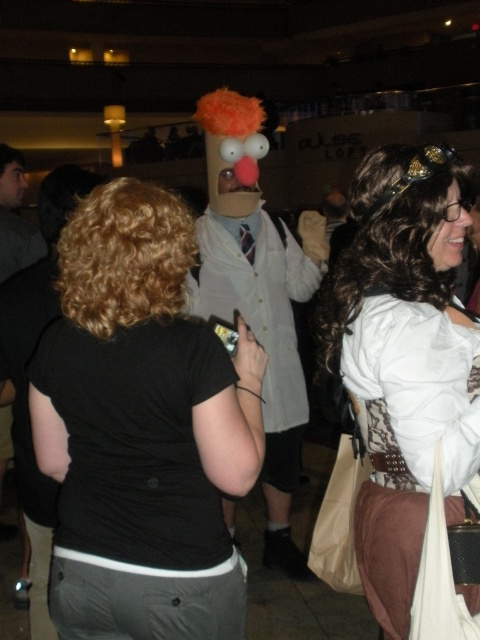
Question: Is black matte shirt at center wider than cardboard mask at center?

Choices:
 (A) no
 (B) yes

Answer: (A)

Question: Which point is closer to the camera?

Choices:
 (A) white satin dress at center
 (B) black matte shirt at center
 (C) cardboard mask at center

Answer: (A)

Question: Is black matte shirt at center smaller than cardboard mask at center?

Choices:
 (A) yes
 (B) no

Answer: (A)

Question: Is black matte shirt at center thinner than white satin dress at center?

Choices:
 (A) no
 (B) yes

Answer: (B)

Question: Which object appears farthest from the camera in this image?

Choices:
 (A) black matte shirt at center
 (B) white satin dress at center
 (C) cardboard mask at center

Answer: (C)

Question: Which object is the farthest from the cardboard mask at center?

Choices:
 (A) black matte shirt at center
 (B) white satin dress at center

Answer: (A)